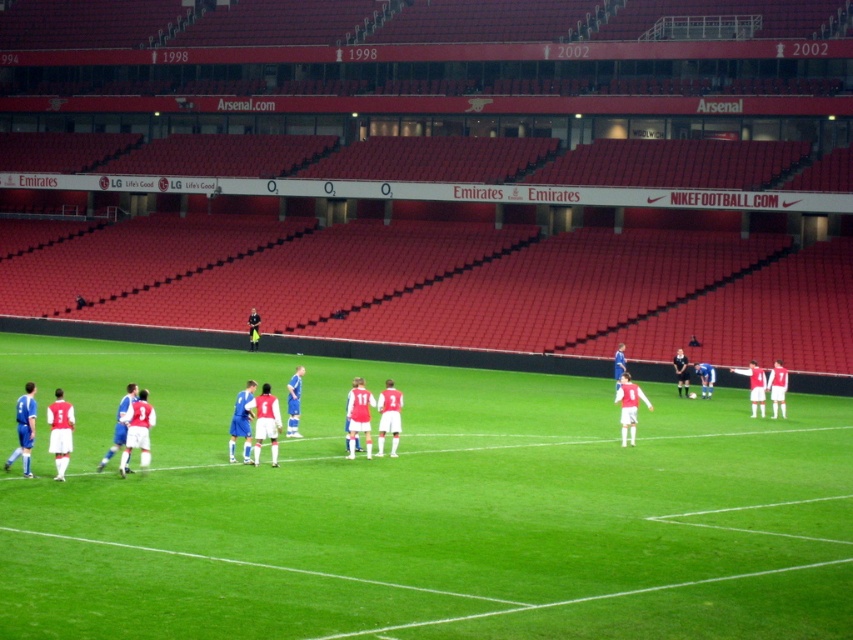
Question: Does green grass football field at center have a smaller size compared to matte red jersey at center?

Choices:
 (A) yes
 (B) no

Answer: (B)

Question: Which of the following is the farthest from the observer?

Choices:
 (A) (180, 536)
 (B) (622, 433)

Answer: (B)

Question: Among these points, which one is farthest from the camera?

Choices:
 (A) (590, 484)
 (B) (631, 410)

Answer: (B)

Question: Which point is farther from the camera taking this photo?

Choices:
 (A) (291, 483)
 (B) (633, 404)

Answer: (B)

Question: From the image, what is the correct spatial relationship of green grass football field at center in relation to matte red jersey at center?

Choices:
 (A) left
 (B) right

Answer: (A)

Question: Is green grass football field at center thinner than matte red jersey at center?

Choices:
 (A) yes
 (B) no

Answer: (B)